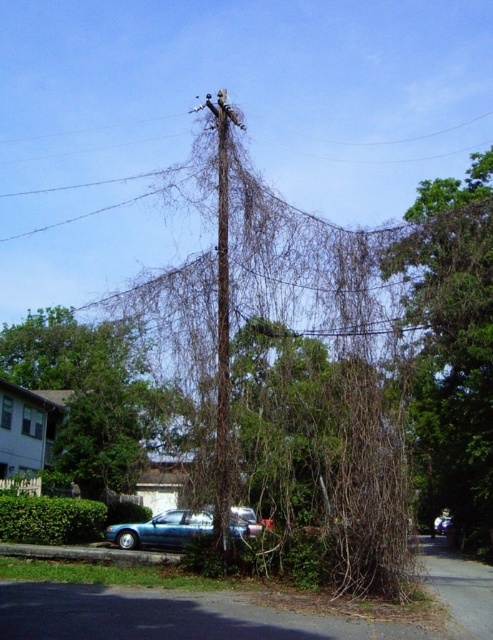
Question: From the image, what is the correct spatial relationship of green leafy tree at center in relation to metallic wire at center?

Choices:
 (A) above
 (B) below

Answer: (B)

Question: Does brown textured vines at upper right appear over teal metallic car at center?

Choices:
 (A) no
 (B) yes

Answer: (B)

Question: Does metallic wire at center lie behind teal metallic car at center?

Choices:
 (A) yes
 (B) no

Answer: (B)

Question: Among these points, which one is farthest from the camera?

Choices:
 (A) (220, 534)
 (B) (154, 422)
 (C) (445, 227)

Answer: (B)

Question: Which point is farther from the camera taking this photo?

Choices:
 (A) (146, 536)
 (B) (216, 496)

Answer: (A)

Question: Which object is farther from the camera taking this photo?

Choices:
 (A) brown textured vines at upper right
 (B) green leafy tree at center

Answer: (B)